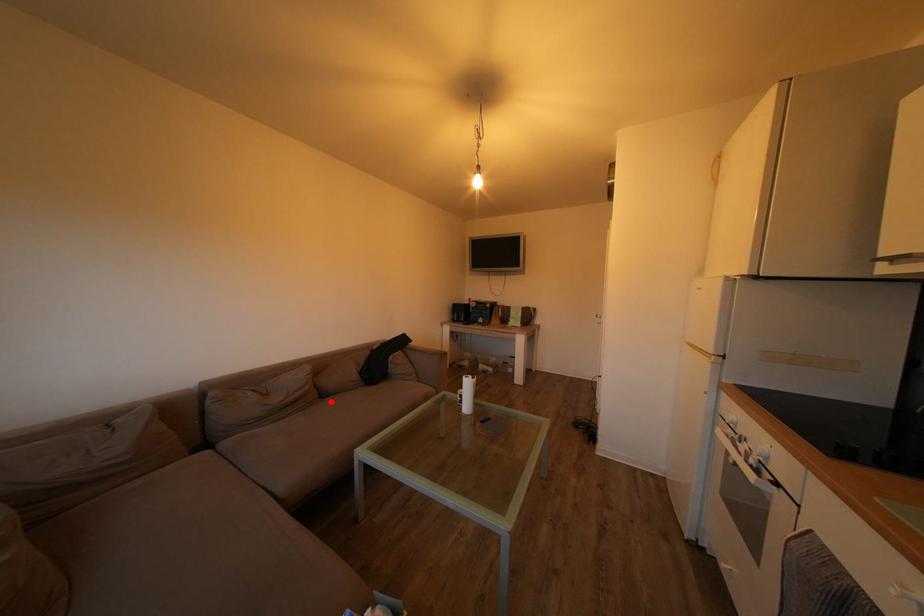
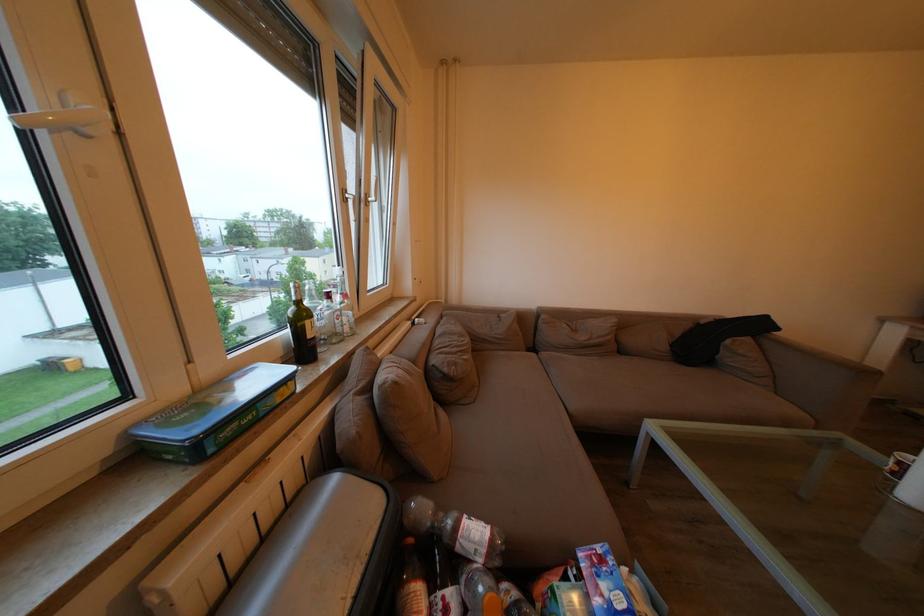
Find the pixel in the second image that matches the highlighted location in the first image.

(629, 358)